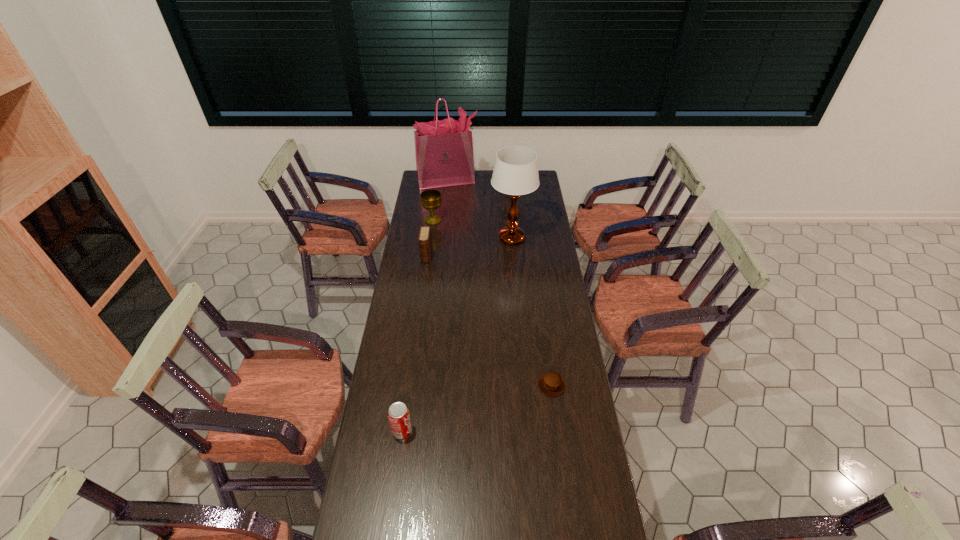
Identify which object is the fourth nearest to the muffin. Please provide its 2D coordinates. Your answer should be formatted as a tuple, i.e. [(x, y)], where the tuple contains the x and y coordinates of a point satisfying the conditions above.

[(430, 199)]